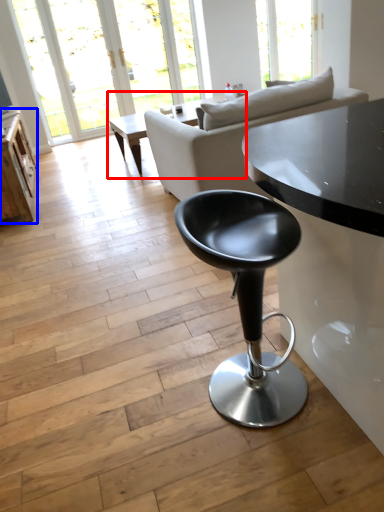
Question: Which point is further to the camera, coffee table (highlighted by a red box) or table (highlighted by a blue box)?

Choices:
 (A) coffee table
 (B) table

Answer: (A)